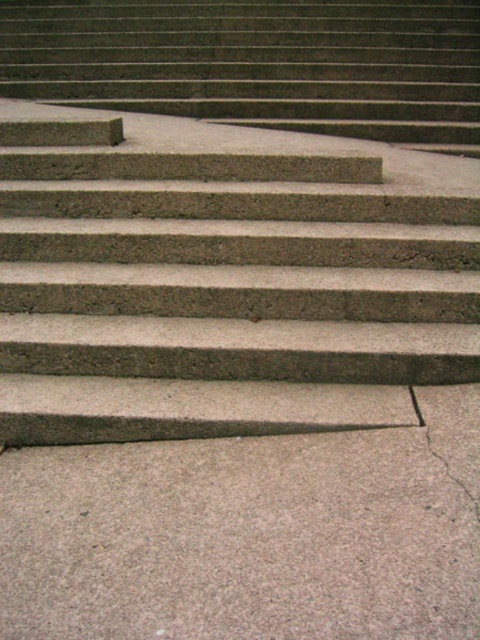
Question: In this image, where is concrete/stone stairs at center located relative to concrete/stone steps at upper left?

Choices:
 (A) above
 (B) below

Answer: (B)

Question: Which point appears farthest from the camera in this image?

Choices:
 (A) (104, 333)
 (B) (382, 90)

Answer: (B)

Question: Is concrete/stone stairs at center closer to the viewer compared to concrete/stone steps at upper left?

Choices:
 (A) no
 (B) yes

Answer: (B)

Question: Which object is closer to the camera taking this photo?

Choices:
 (A) concrete/stone steps at upper left
 (B) concrete/stone stairs at center

Answer: (B)

Question: From the image, what is the correct spatial relationship of concrete/stone stairs at center in relation to concrete/stone steps at upper left?

Choices:
 (A) right
 (B) left

Answer: (B)